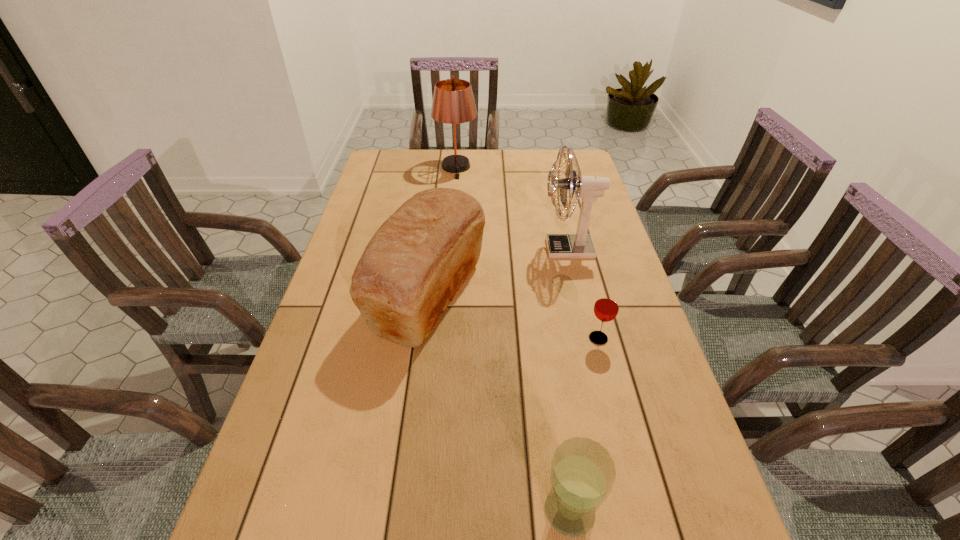
Image resolution: width=960 pixels, height=540 pixels. Find the location of `free space located on the back of the farther glass`. free space located on the back of the farther glass is located at coordinates pos(571,234).

What are the coordinates of `object located at the far edge` in the screenshot? It's located at (453, 102).

Where is `object situated at the left edge`? This screenshot has width=960, height=540. object situated at the left edge is located at coordinates (415, 263).

You are a GUI agent. You are given a task and a screenshot of the screen. Output one action in this format:
    pyautogui.click(x=<x>, y=<y>)
    Task: Click on the fan located in the right edge section of the desktop
    
    Given the screenshot: What is the action you would take?
    pyautogui.click(x=580, y=245)

I want to click on glass located in the right edge section of the desktop, so click(606, 307).

Locate an element on the screen. This screenshot has height=540, width=960. vacant space at the far edge of the desktop is located at coordinates (435, 153).

Identify the location of vacant space at the left edge of the desktop. (302, 406).

Where is `vacant region at the right edge of the desktop`? vacant region at the right edge of the desktop is located at coordinates (594, 234).

This screenshot has width=960, height=540. Find the location of `vacant space in between the fan and the right glass`. vacant space in between the fan and the right glass is located at coordinates (584, 294).

You are a GUI agent. You are given a task and a screenshot of the screen. Output one action in this format:
    pyautogui.click(x=<x>, y=<y>)
    Task: Click on the free space between the fan and the farthest object
    The height and width of the screenshot is (540, 960).
    Given the screenshot: What is the action you would take?
    pyautogui.click(x=512, y=208)